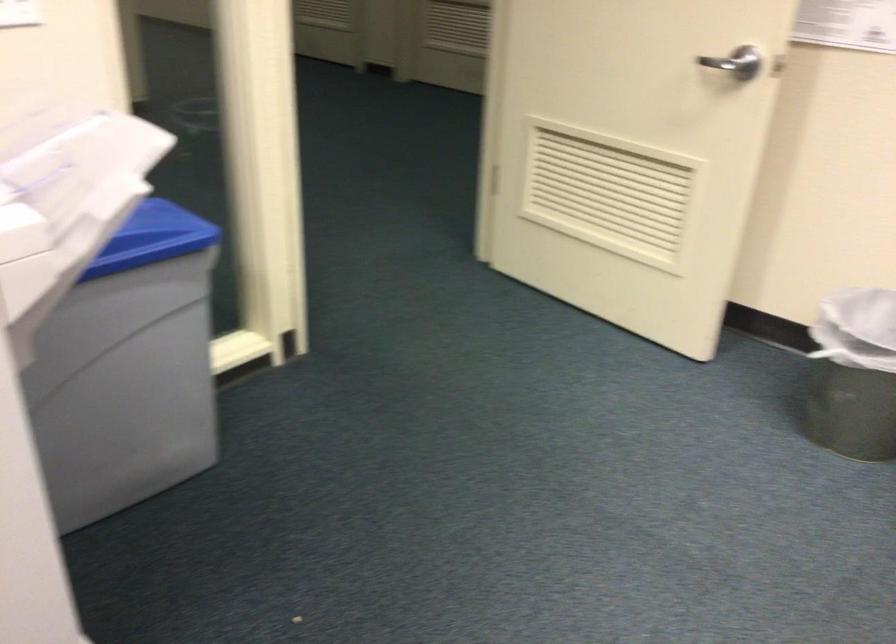
Describe the element at coordinates (736, 62) in the screenshot. The image size is (896, 644). I see `the silver door handle` at that location.